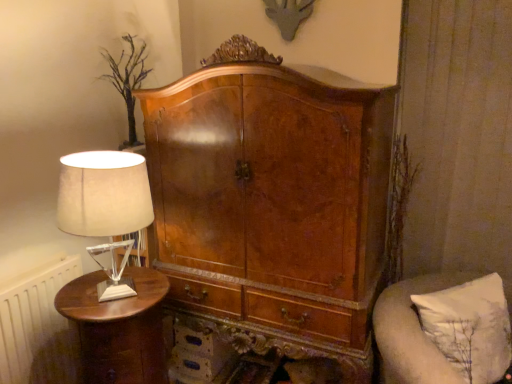
Question: From a real-world perspective, is shiny brown wood nightstand at left on top of white fabric pillow at right?

Choices:
 (A) no
 (B) yes

Answer: (A)

Question: Is shiny brown wood nightstand at left closer to the viewer compared to white fabric pillow at right?

Choices:
 (A) yes
 (B) no

Answer: (B)

Question: Does shiny brown wood nightstand at left appear on the right side of white fabric pillow at right?

Choices:
 (A) no
 (B) yes

Answer: (A)

Question: Considering the relative sizes of shiny brown wood nightstand at left and white fabric pillow at right in the image provided, is shiny brown wood nightstand at left taller than white fabric pillow at right?

Choices:
 (A) no
 (B) yes

Answer: (B)

Question: Considering the relative sizes of shiny brown wood nightstand at left and white fabric pillow at right in the image provided, is shiny brown wood nightstand at left shorter than white fabric pillow at right?

Choices:
 (A) no
 (B) yes

Answer: (A)

Question: Can you confirm if shiny brown wood nightstand at left is smaller than white fabric pillow at right?

Choices:
 (A) yes
 (B) no

Answer: (B)

Question: Is white fabric lampshade at left closer to camera compared to shiny brown wood nightstand at left?

Choices:
 (A) no
 (B) yes

Answer: (B)

Question: Is white fabric lampshade at left taller than shiny brown wood nightstand at left?

Choices:
 (A) yes
 (B) no

Answer: (B)

Question: Does white fabric lampshade at left come behind shiny brown wood nightstand at left?

Choices:
 (A) no
 (B) yes

Answer: (A)

Question: From the image's perspective, would you say white fabric lampshade at left is shown under shiny brown wood nightstand at left?

Choices:
 (A) no
 (B) yes

Answer: (A)

Question: From the image's perspective, is white fabric lampshade at left located above shiny brown wood nightstand at left?

Choices:
 (A) yes
 (B) no

Answer: (A)

Question: Can you confirm if white fabric lampshade at left is bigger than shiny brown wood nightstand at left?

Choices:
 (A) yes
 (B) no

Answer: (B)

Question: Is shiny brown wood nightstand at left next to white fabric lampshade at left?

Choices:
 (A) yes
 (B) no

Answer: (B)